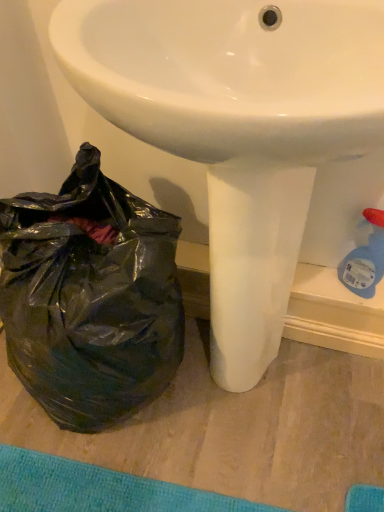
Question: From the image's perspective, is white glossy sink at center over black plastic bag at lower left?

Choices:
 (A) no
 (B) yes

Answer: (B)

Question: Is white glossy sink at center oriented towards black plastic bag at lower left?

Choices:
 (A) no
 (B) yes

Answer: (A)

Question: Is black plastic bag at lower left at the back of white glossy sink at center?

Choices:
 (A) no
 (B) yes

Answer: (A)

Question: Can you see white glossy sink at center touching black plastic bag at lower left?

Choices:
 (A) no
 (B) yes

Answer: (A)

Question: Considering the relative positions of white glossy sink at center and black plastic bag at lower left in the image provided, is white glossy sink at center to the right of black plastic bag at lower left from the viewer's perspective?

Choices:
 (A) yes
 (B) no

Answer: (A)

Question: Does white glossy sink at center have a larger size compared to black plastic bag at lower left?

Choices:
 (A) yes
 (B) no

Answer: (A)

Question: Is black plastic bag at lower left aimed at white glossy sink at center?

Choices:
 (A) yes
 (B) no

Answer: (B)

Question: Is black plastic bag at lower left positioned far away from white glossy sink at center?

Choices:
 (A) yes
 (B) no

Answer: (B)

Question: Is black plastic bag at lower left looking in the opposite direction of white glossy sink at center?

Choices:
 (A) yes
 (B) no

Answer: (B)

Question: Does black plastic bag at lower left have a lesser width compared to white glossy sink at center?

Choices:
 (A) yes
 (B) no

Answer: (A)

Question: From the image's perspective, is black plastic bag at lower left on white glossy sink at center?

Choices:
 (A) yes
 (B) no

Answer: (B)

Question: From a real-world perspective, does black plastic bag at lower left stand above white glossy sink at center?

Choices:
 (A) yes
 (B) no

Answer: (B)

Question: From the image's perspective, relative to black plastic bag at lower left, is white glossy sink at center above or below?

Choices:
 (A) below
 (B) above

Answer: (B)